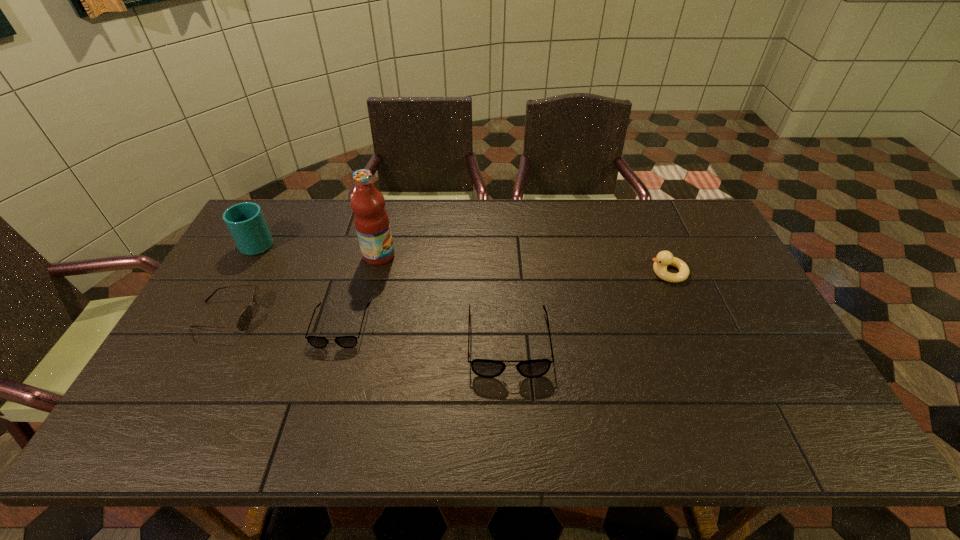
The height and width of the screenshot is (540, 960). Identify the location of free space that is in between the second tallest object and the right spectacles. (383, 292).

The image size is (960, 540). Identify the location of free point between the shorter spectacles and the tallest object. (360, 291).

I want to click on empty space that is in between the shorter spectacles and the second tallest object, so click(300, 284).

Where is `free spot between the cup and the second object from right to left`? This screenshot has height=540, width=960. free spot between the cup and the second object from right to left is located at coordinates (383, 292).

The height and width of the screenshot is (540, 960). I want to click on unoccupied area between the right spectacles and the tallest object, so tap(444, 299).

The width and height of the screenshot is (960, 540). What are the coordinates of `empty space that is in between the second shortest object and the second object from right to left` in the screenshot? It's located at (369, 328).

You are a GUI agent. You are given a task and a screenshot of the screen. Output one action in this format:
    pyautogui.click(x=<x>, y=<y>)
    Task: Click on the empty location between the cup and the second shortest object
    
    Given the screenshot: What is the action you would take?
    pyautogui.click(x=244, y=279)

Choose which object is the fourth nearest neighbor to the rightmost object. Please provide its 2D coordinates. Your answer should be formatted as a tuple, i.e. [(x, y)], where the tuple contains the x and y coordinates of a point satisfying the conditions above.

[(243, 322)]

Locate which object ranks in proximity to the fruit juice. Please provide its 2D coordinates. Your answer should be formatted as a tuple, i.e. [(x, y)], where the tuple contains the x and y coordinates of a point satisfying the conditions above.

[(316, 341)]

This screenshot has width=960, height=540. In order to click on free space that satisfies the following two spatial constraints: 1. at the beak of the duckling; 2. on the front-facing side of the right spectacles in this screenshot , I will do `click(697, 342)`.